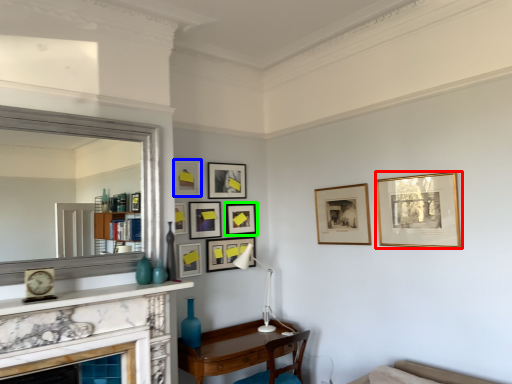
Question: Which object is positioned closest to picture frame (highlighted by a red box)? Select from picture frame (highlighted by a blue box) and picture frame (highlighted by a green box).

Choices:
 (A) picture frame
 (B) picture frame

Answer: (B)